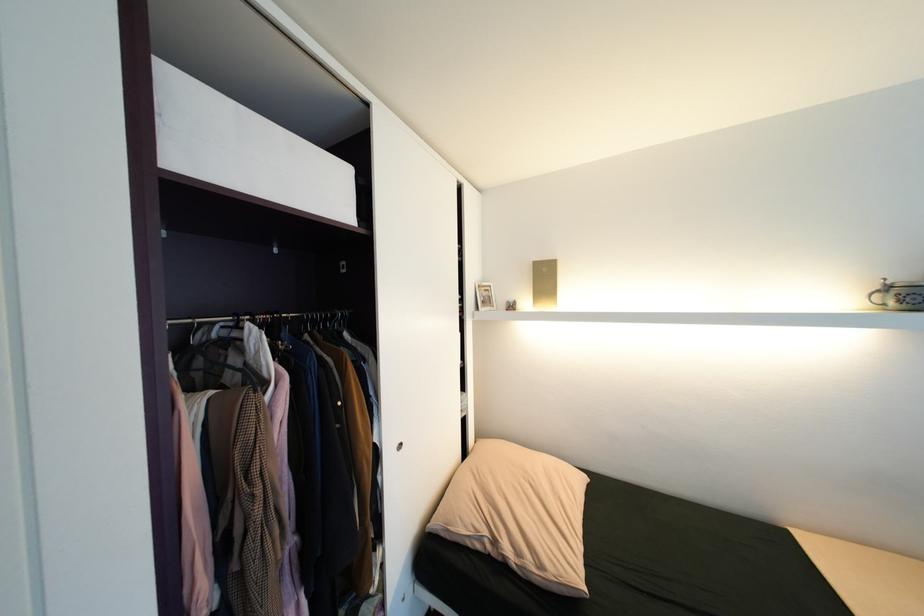
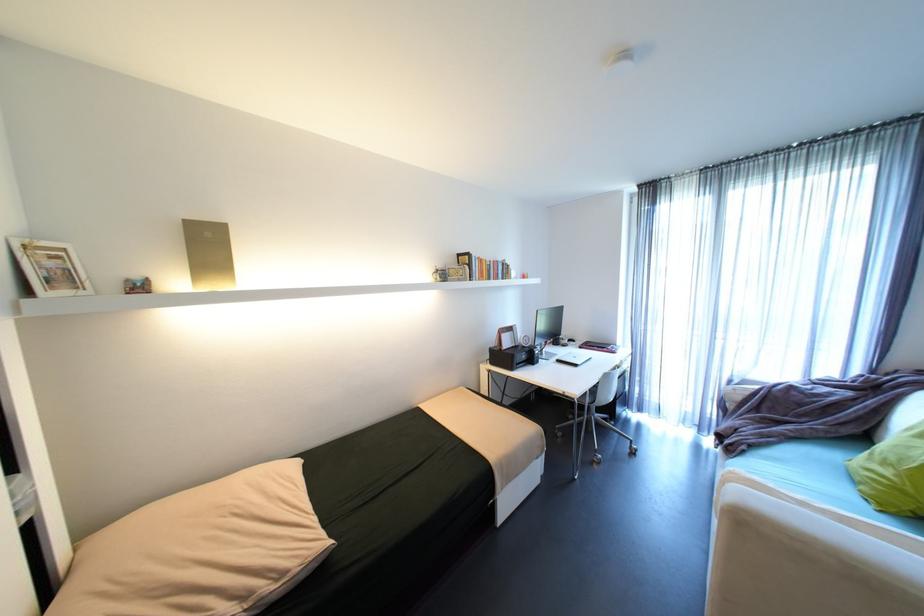
Find the pixel in the second image that matches (892,280) in the first image.

(444, 267)